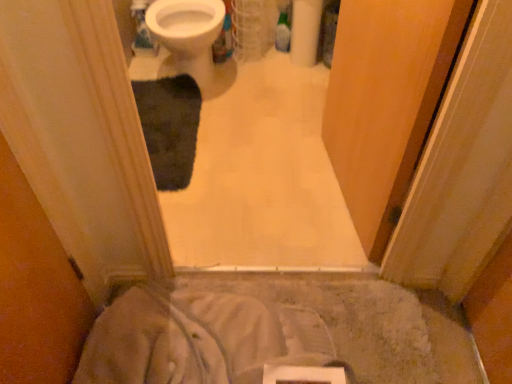
Where is `free spot below dark gray plush bath mat at center (from a real-world perspective)`? This screenshot has height=384, width=512. free spot below dark gray plush bath mat at center (from a real-world perspective) is located at coordinates (173, 136).